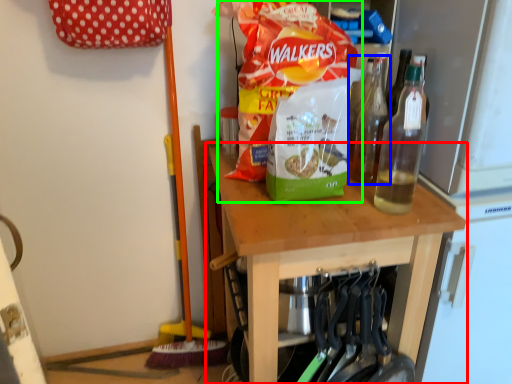
Question: Based on their relative distances, which object is farther from table (highlighted by a red box)? Choose from bottle (highlighted by a blue box) and waste (highlighted by a green box).

Choices:
 (A) bottle
 (B) waste

Answer: (A)